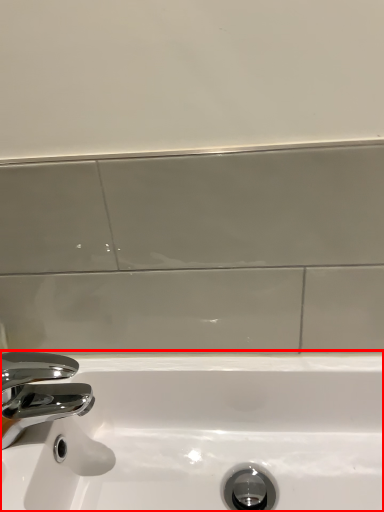
Question: Where is sink (annotated by the red box) located in relation to tap in the image?

Choices:
 (A) left
 (B) right

Answer: (B)